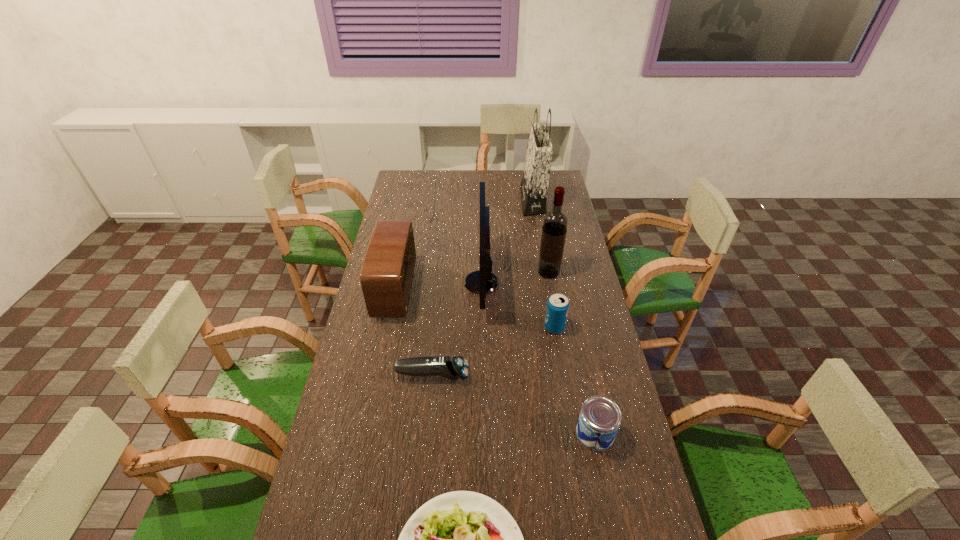
At what (x,y) coordinates should I click in order to perform the action: click on free space at the far edge. Please return your answer as a coordinate pair (x, y). Looking at the image, I should click on (495, 179).

Image resolution: width=960 pixels, height=540 pixels. I want to click on vacant space at the left edge of the desktop, so click(330, 472).

I want to click on free space at the right edge, so click(x=579, y=247).

The width and height of the screenshot is (960, 540). In order to click on unoccupied area between the second tallest object and the second shortest object in this screenshot , I will do `click(491, 324)`.

Identify the location of vacant space in between the fourth tallest object and the shopping bag. (464, 246).

Identify the location of free point between the third tallest object and the can. (539, 357).

Find the location of a particular element. The image size is (960, 540). unoccupied area between the computer monitor and the sixth tallest object is located at coordinates (539, 357).

Where is `object identified as the sixth closest to the nearest object`? object identified as the sixth closest to the nearest object is located at coordinates (555, 222).

Select which object appears as the fifth closest to the nearest object. Please provide its 2D coordinates. Your answer should be formatted as a tuple, i.e. [(x, y)], where the tuple contains the x and y coordinates of a point satisfying the conditions above.

[(386, 277)]

I want to click on vacant region that satisfies the following two spatial constraints: 1. on the front of the shopping bag with the design; 2. on the left side of the soda can, so click(x=553, y=327).